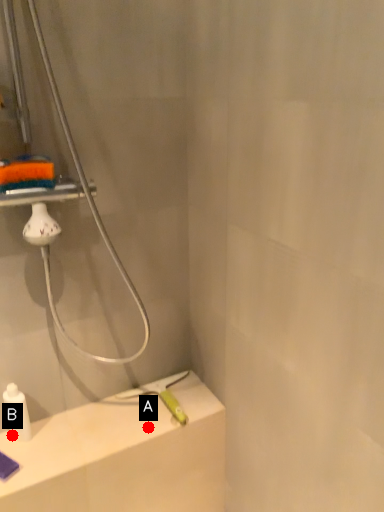
Question: Two points are circled on the image, labeled by A and B beside each circle. Which point appears closest to the camera in this image?

Choices:
 (A) A is closer
 (B) B is closer

Answer: (B)